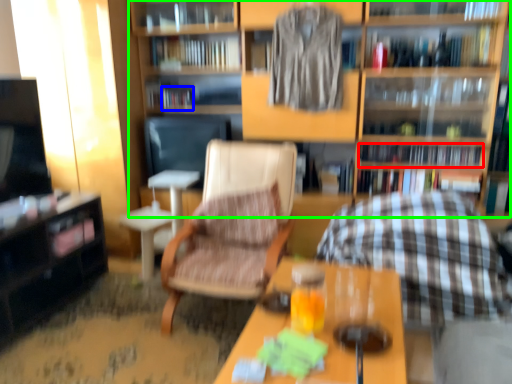
Question: Which object is the closest to the book (highlighted by a red box)? Choose among these: book (highlighted by a blue box) or shelf (highlighted by a green box).

Choices:
 (A) book
 (B) shelf

Answer: (B)